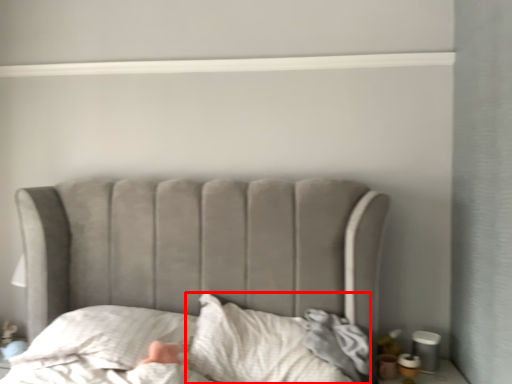
Question: Considering the relative positions of sheet (annotated by the red box) and throw pillow in the image provided, where is sheet (annotated by the red box) located with respect to the staircase?

Choices:
 (A) right
 (B) left

Answer: (A)